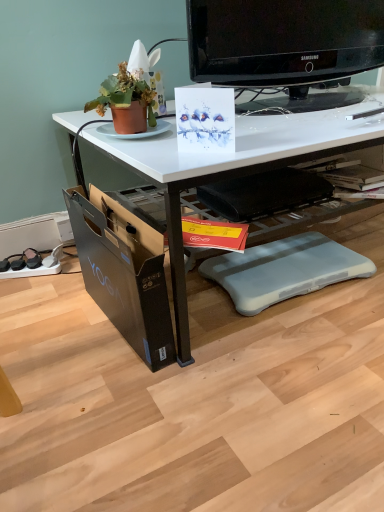
Question: Is yellow paper magazine at center outside of black cardboard file cabinet at lower left?

Choices:
 (A) no
 (B) yes

Answer: (B)

Question: Is yellow paper magazine at center further to the viewer compared to black cardboard file cabinet at lower left?

Choices:
 (A) yes
 (B) no

Answer: (A)

Question: From a real-world perspective, does yellow paper magazine at center sit lower than black cardboard file cabinet at lower left?

Choices:
 (A) no
 (B) yes

Answer: (A)

Question: Would you say yellow paper magazine at center is a long distance from black cardboard file cabinet at lower left?

Choices:
 (A) no
 (B) yes

Answer: (A)

Question: Does yellow paper magazine at center have a greater height compared to black cardboard file cabinet at lower left?

Choices:
 (A) yes
 (B) no

Answer: (B)

Question: Relative to terracotta clay pot at upper left, is black plastic swivel chair at center, placed as the 1th swivel chair when sorted from top to bottom, in front or behind?

Choices:
 (A) behind
 (B) front

Answer: (A)

Question: From the image's perspective, is black plastic swivel chair at center, the 2th swivel chair when ordered from bottom to top, located above or below terracotta clay pot at upper left?

Choices:
 (A) above
 (B) below

Answer: (B)

Question: Is black plastic swivel chair at center, placed as the 1th swivel chair when sorted from top to bottom, inside the boundaries of terracotta clay pot at upper left, or outside?

Choices:
 (A) outside
 (B) inside

Answer: (A)

Question: Is black plastic swivel chair at center, placed as the 1th swivel chair when sorted from top to bottom, bigger or smaller than terracotta clay pot at upper left?

Choices:
 (A) small
 (B) big

Answer: (B)

Question: Looking at the image, does black glossy television at upper center seem bigger or smaller compared to black cardboard file cabinet at lower left?

Choices:
 (A) big
 (B) small

Answer: (A)

Question: From the image's perspective, relative to black cardboard file cabinet at lower left, is black glossy television at upper center above or below?

Choices:
 (A) above
 (B) below

Answer: (A)

Question: Is point (241, 50) positioned closer to the camera than point (134, 259)?

Choices:
 (A) closer
 (B) farther

Answer: (B)

Question: Relative to black cardboard file cabinet at lower left, is black glossy television at upper center in front or behind?

Choices:
 (A) front
 (B) behind

Answer: (B)

Question: From their relative heights in the image, would you say black cardboard file cabinet at lower left is taller or shorter than terracotta clay pot at upper left?

Choices:
 (A) short
 (B) tall

Answer: (B)

Question: Is point (137, 228) positioned closer to the camera than point (137, 81)?

Choices:
 (A) farther
 (B) closer

Answer: (B)